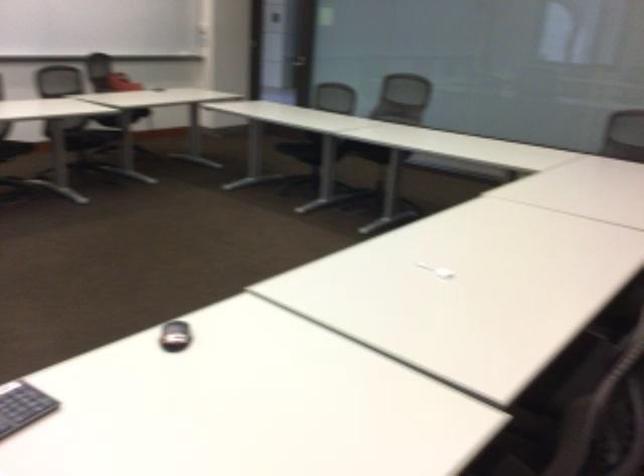
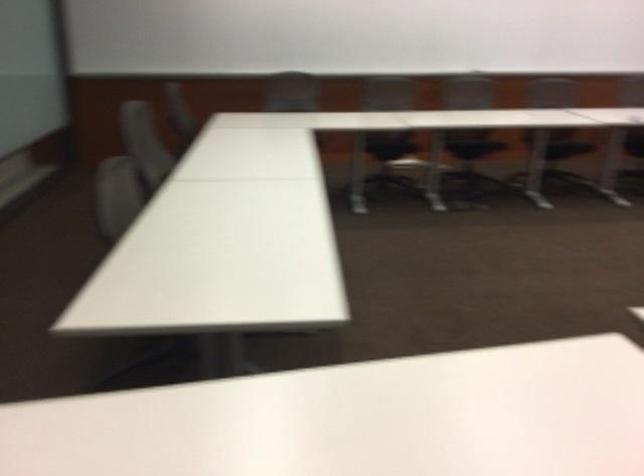
Based on the continuous images, in which direction is the camera rotating?

The camera rotated toward right-down.